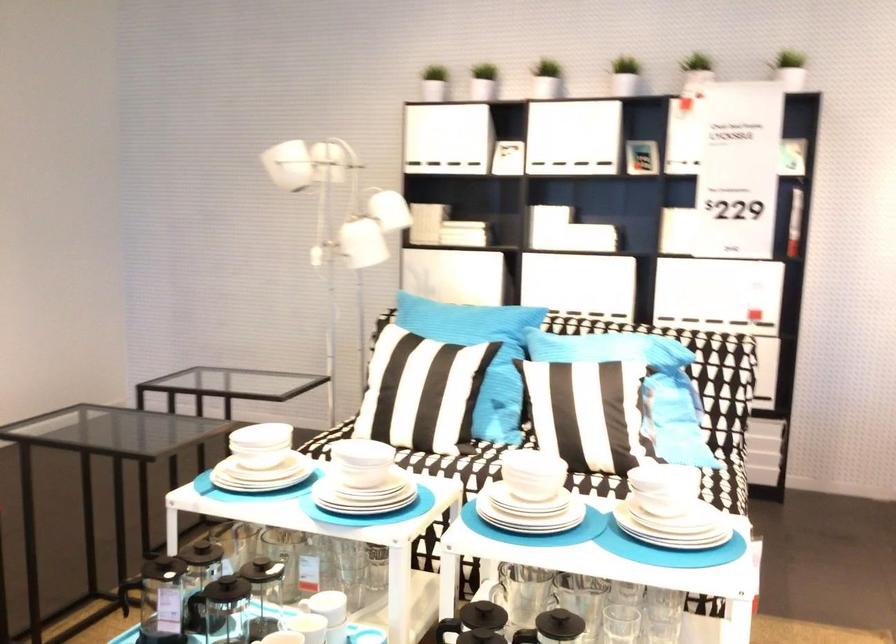
Describe the element at coordinates (619, 442) in the screenshot. I see `the sofa sitting surface` at that location.